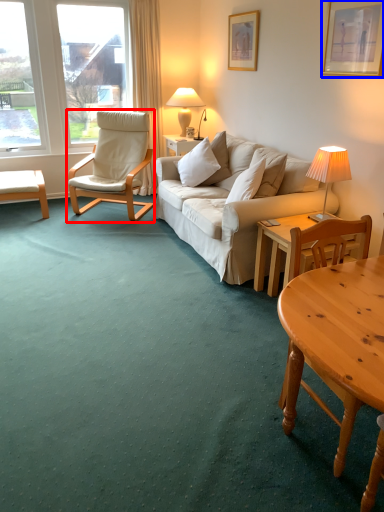
Question: Which object appears closest to the camera in this image, chair (highlighted by a red box) or picture frame (highlighted by a blue box)?

Choices:
 (A) chair
 (B) picture frame

Answer: (B)